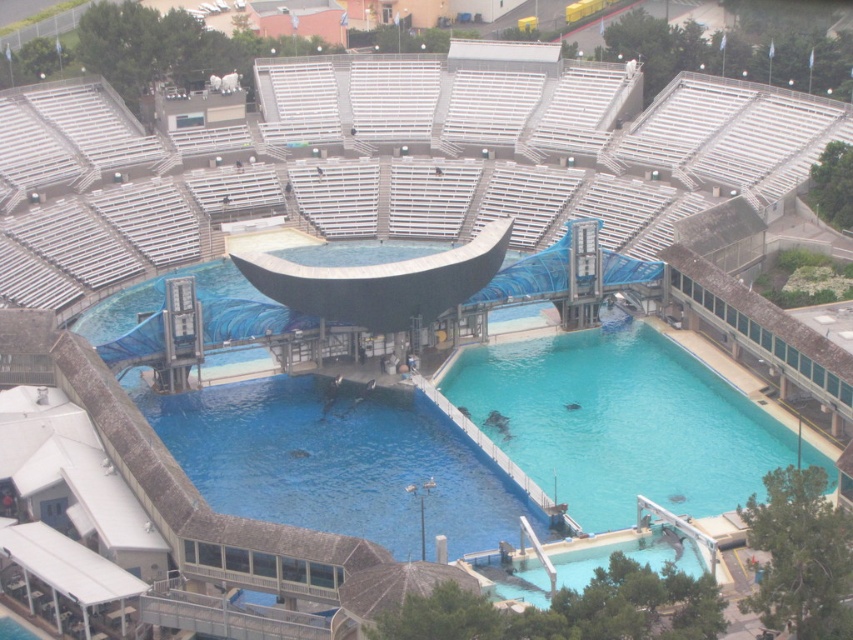
You are a marine biologist observing the pool from above. You notice two sections of water at the center of the pool labeled as clear blue water at center and blue smooth water at center. Which section is wider?

The blue smooth water at center is wider than the clear blue water at center.